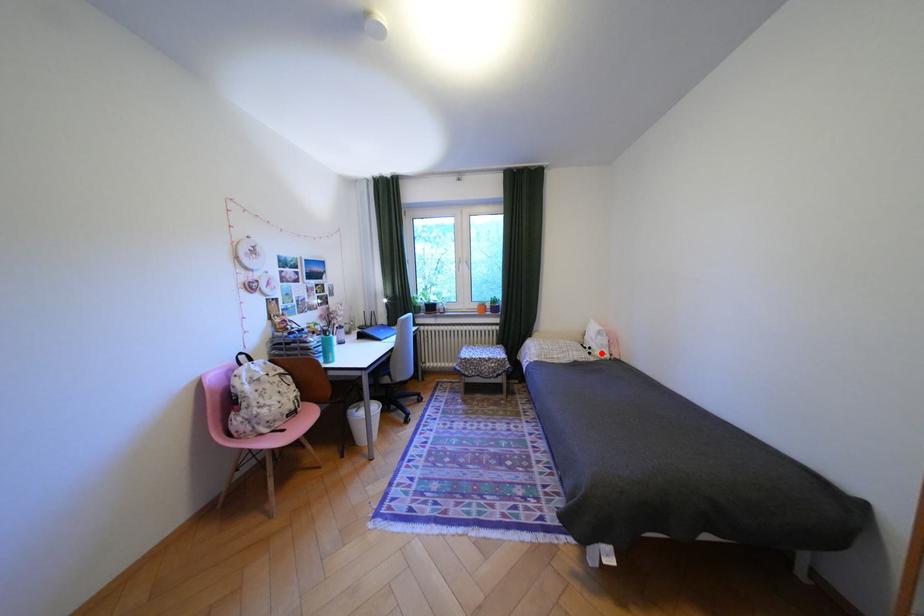
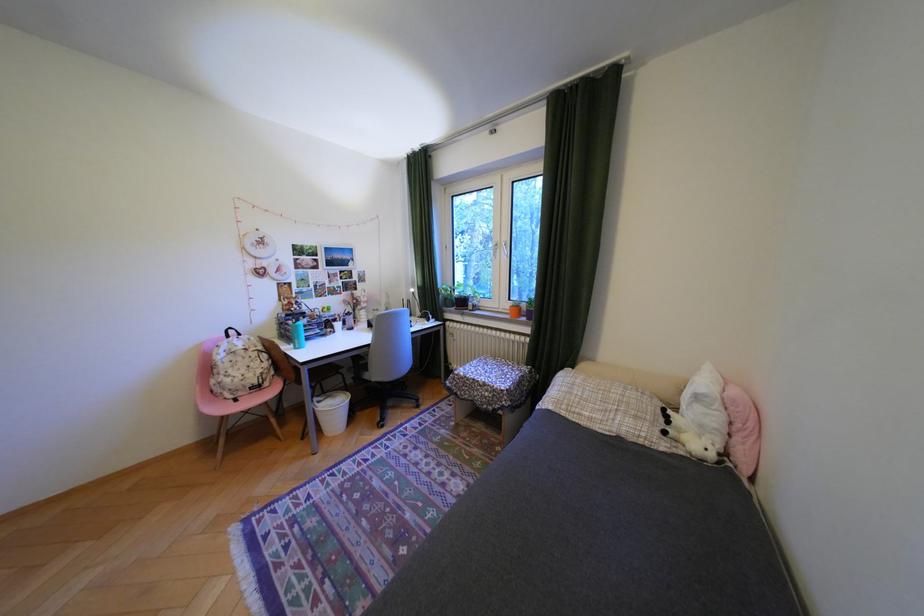
Locate, in the second image, the point that corresponds to the highlighted location in the first image.

(676, 432)